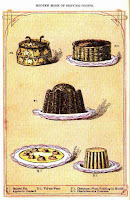
This screenshot has height=200, width=130. Find the location of `white plate`. white plate is located at coordinates (65, 157), (21, 159), (78, 165), (113, 165), (84, 113), (66, 115), (110, 59), (71, 58).